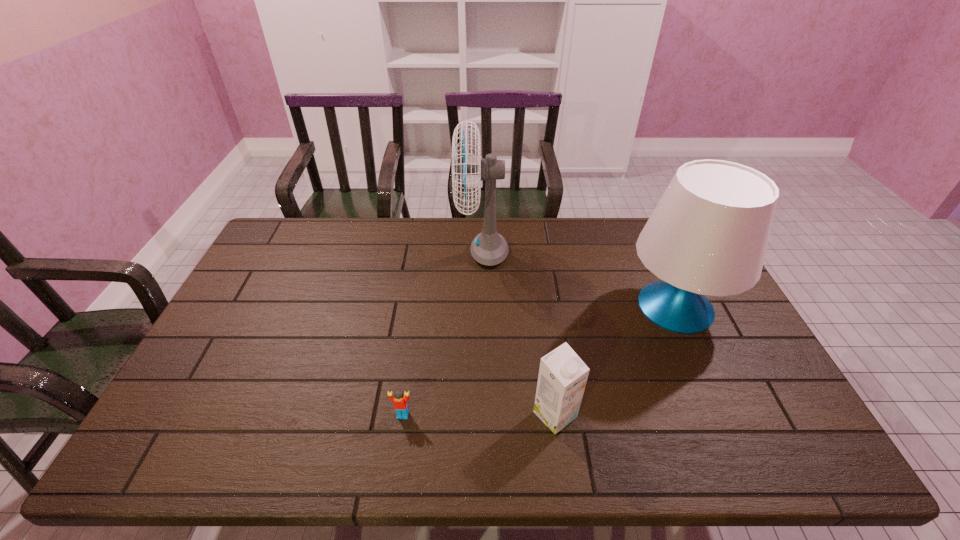
The image size is (960, 540). Identify the location of vacant space that satisfies the following two spatial constraints: 1. on the front-facing side of the fan; 2. on the left side of the carton. (484, 415).